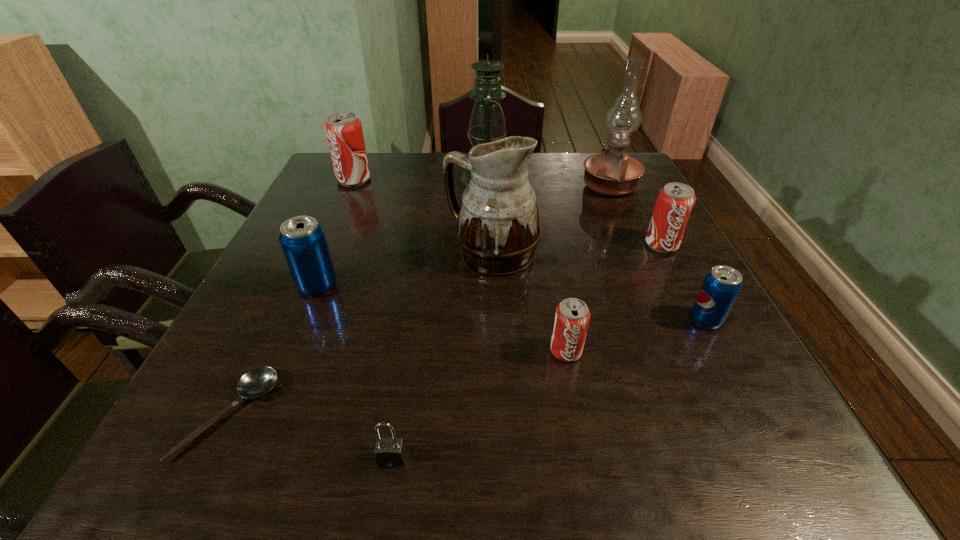
I want to click on free location located from the spout of the brown pitcher, so click(284, 253).

At what (x,y) coordinates should I click in order to perform the action: click on free space located 0.120m from the spout of the brown pitcher. Please return your answer as a coordinate pair (x, y). Image resolution: width=960 pixels, height=540 pixels. Looking at the image, I should click on (393, 253).

This screenshot has width=960, height=540. I want to click on free spot located from the spout of the brown pitcher, so click(x=332, y=253).

The image size is (960, 540). In order to click on vacant area located on the front of the farthest pink soda can in this screenshot , I will do `click(324, 246)`.

You are a GUI agent. You are given a task and a screenshot of the screen. Output one action in this format:
    pyautogui.click(x=<x>, y=<y>)
    Task: Click on the free spot located 0.330m on the back of the rightmost pink soda can
    
    Given the screenshot: What is the action you would take?
    pyautogui.click(x=623, y=171)

Locate an element on the screen. This screenshot has height=540, width=960. free space located 0.250m on the front of the left blue pop soda is located at coordinates (268, 407).

At what (x,y) coordinates should I click in order to perform the action: click on blank space located on the front of the seventh farthest object. Please return your answer as a coordinate pair (x, y). The width and height of the screenshot is (960, 540). Looking at the image, I should click on (773, 445).

Locate an element on the screen. vacant space located 0.190m on the left of the smallest pink soda can is located at coordinates (445, 351).

Where is `vacant point located on the back of the gray ladle`? The width and height of the screenshot is (960, 540). vacant point located on the back of the gray ladle is located at coordinates (276, 318).

The width and height of the screenshot is (960, 540). What are the coordinates of `soda can that is at the far edge` in the screenshot? It's located at [x=344, y=134].